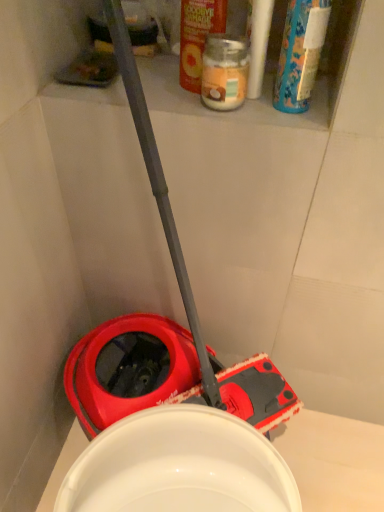
Question: Is blue plastic bottle at upper right, positioned as the second cleaning product in left-to-right order, beside translucent glass jar at upper center?

Choices:
 (A) no
 (B) yes

Answer: (B)

Question: From a real-world perspective, does blue plastic bottle at upper right, positioned as the second cleaning product in left-to-right order, sit lower than translucent glass jar at upper center?

Choices:
 (A) yes
 (B) no

Answer: (B)

Question: Considering the relative sizes of blue plastic bottle at upper right, positioned as the second cleaning product in left-to-right order, and translucent glass jar at upper center in the image provided, is blue plastic bottle at upper right, positioned as the second cleaning product in left-to-right order, taller than translucent glass jar at upper center?

Choices:
 (A) no
 (B) yes

Answer: (B)

Question: Is blue plastic bottle at upper right, positioned as the second cleaning product in left-to-right order, not within translucent glass jar at upper center?

Choices:
 (A) no
 (B) yes

Answer: (B)

Question: From a real-world perspective, is blue plastic bottle at upper right, which is counted as the 1th cleaning product, starting from the right, physically above translucent glass jar at upper center?

Choices:
 (A) yes
 (B) no

Answer: (A)

Question: Which is correct: translucent glass jar at upper center is inside blue plastic bottle at upper right, which is counted as the 1th cleaning product, starting from the right, or outside of it?

Choices:
 (A) outside
 (B) inside

Answer: (A)

Question: Considering the positions of point (223, 82) and point (312, 51), is point (223, 82) closer or farther from the camera than point (312, 51)?

Choices:
 (A) closer
 (B) farther

Answer: (B)

Question: Is translucent glass jar at upper center bigger or smaller than blue plastic bottle at upper right, positioned as the second cleaning product in left-to-right order?

Choices:
 (A) big
 (B) small

Answer: (B)

Question: Relative to blue plastic bottle at upper right, positioned as the second cleaning product in left-to-right order, is translucent glass jar at upper center in front or behind?

Choices:
 (A) behind
 (B) front

Answer: (A)

Question: Based on their sizes in the image, would you say orange matte jar at upper center, the 2th cleaning product viewed from the right, is bigger or smaller than blue plastic bottle at upper right, which is counted as the 1th cleaning product, starting from the right?

Choices:
 (A) small
 (B) big

Answer: (A)

Question: Choose the correct answer: Is orange matte jar at upper center, the 2th cleaning product viewed from the right, inside blue plastic bottle at upper right, positioned as the second cleaning product in left-to-right order, or outside it?

Choices:
 (A) inside
 (B) outside

Answer: (B)

Question: Considering the positions of point (190, 11) and point (301, 32), is point (190, 11) closer or farther from the camera than point (301, 32)?

Choices:
 (A) farther
 (B) closer

Answer: (A)

Question: In terms of height, does orange matte jar at upper center, the 2th cleaning product viewed from the right, look taller or shorter compared to blue plastic bottle at upper right, which is counted as the 1th cleaning product, starting from the right?

Choices:
 (A) tall
 (B) short

Answer: (B)

Question: Is point (301, 34) closer or farther from the camera than point (188, 57)?

Choices:
 (A) farther
 (B) closer

Answer: (B)

Question: In terms of height, does blue plastic bottle at upper right, which is counted as the 1th cleaning product, starting from the right, look taller or shorter compared to orange matte jar at upper center, which is the 1th cleaning product from left to right?

Choices:
 (A) tall
 (B) short

Answer: (A)